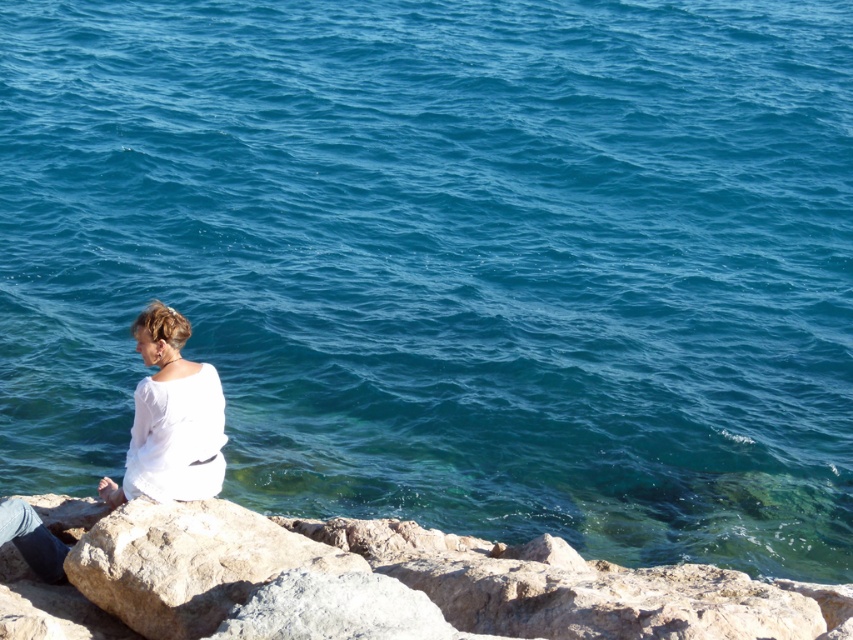
Which is more to the right, rough stone cliff at lower left or white cotton shirt at lower left?

From the viewer's perspective, rough stone cliff at lower left appears more on the right side.

Is point (300, 609) behind point (175, 432)?

That is False.

Which is in front, point (265, 605) or point (155, 404)?

Point (265, 605)

Find the location of a particular element. The image size is (853, 640). rough stone cliff at lower left is located at coordinates (375, 584).

Is gray rough rock at lower left below white cotton shirt at lower left?

Correct, gray rough rock at lower left is located below white cotton shirt at lower left.

Can you confirm if gray rough rock at lower left is wider than white cotton shirt at lower left?

Yes, gray rough rock at lower left is wider than white cotton shirt at lower left.

Does point (202, 628) come farther from viewer compared to point (142, 387)?

No, it is not.

Image resolution: width=853 pixels, height=640 pixels. I want to click on gray rough rock at lower left, so click(x=189, y=563).

Describe the element at coordinates (375, 584) in the screenshot. I see `rough stone cliff at lower left` at that location.

Is rough stone cliff at lower left taller than gray rough rock at lower left?

No, rough stone cliff at lower left is not taller than gray rough rock at lower left.

The image size is (853, 640). What do you see at coordinates (375, 584) in the screenshot? I see `rough stone cliff at lower left` at bounding box center [375, 584].

The height and width of the screenshot is (640, 853). What are the coordinates of `rough stone cliff at lower left` in the screenshot? It's located at (375, 584).